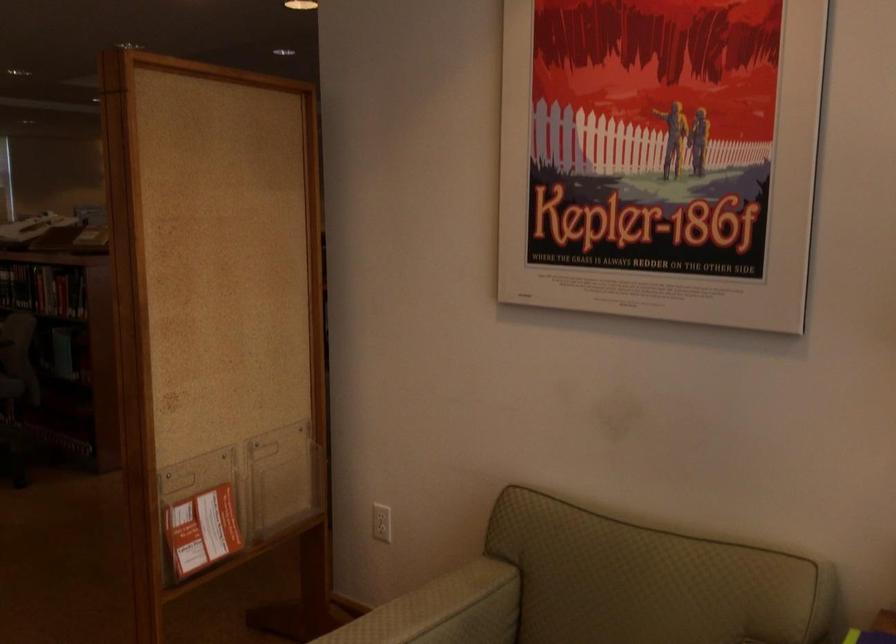
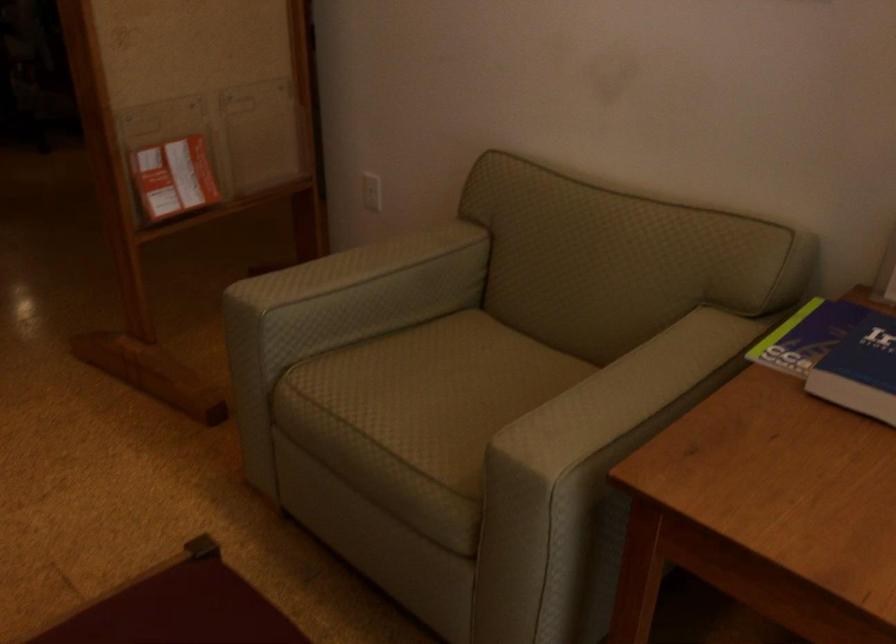
Question: The first image is from the beginning of the video and the second image is from the end. How did the camera likely rotate when shooting the video?

Choices:
 (A) Left
 (B) Right
 (C) Up
 (D) Down

Answer: (D)